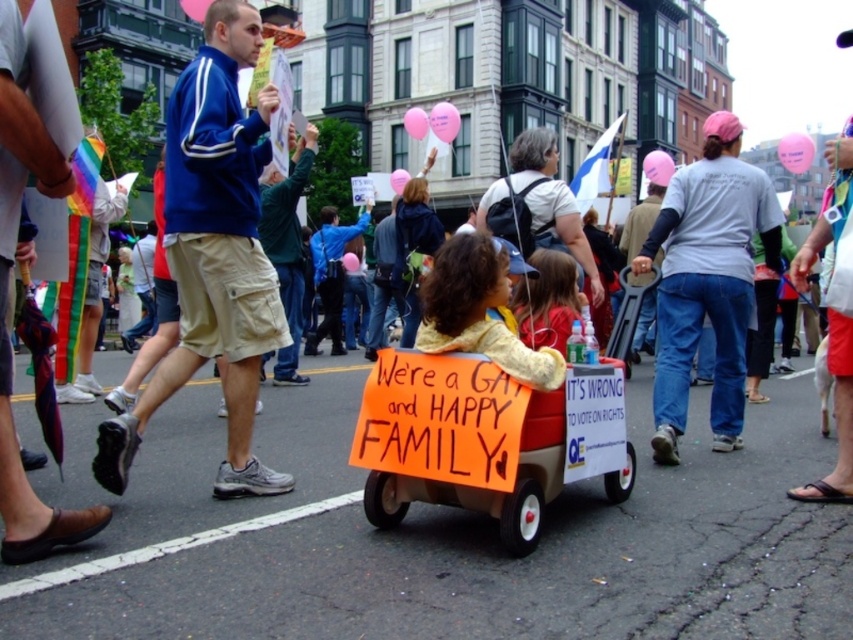
You are a photographer trying to capture a clear shot of the blue synthetic jacket at center and the matte white shirt at center. Which one is closer to the camera?

The blue synthetic jacket at center is positioned under the matte white shirt at center, so the matte white shirt at center is closer to the camera.

You are a photographer standing at the center of the street. You want to take a photo that includes both the blue fabric jacket at center and the gray cotton shirt at center. If your camera has a maximum focus range of 20 feet, will both subjects be in focus?

The blue fabric jacket at center is 19.57 feet away from the gray cotton shirt at center. Since the maximum focus range is 20 feet, both subjects will be within the focus range and thus in focus.

You are a photographer standing at the camera position. You want to take a closeup of the orange cardboard wagon at center. The camera lens can focus as close as 3 meters. Is the wagon within the focus range?

The orange cardboard wagon at center is 6.35 meters away from the camera. Since the camera lens can focus as close as 3 meters, the wagon is beyond the minimum focus distance. Therefore, the photographer can focus on the wagon.